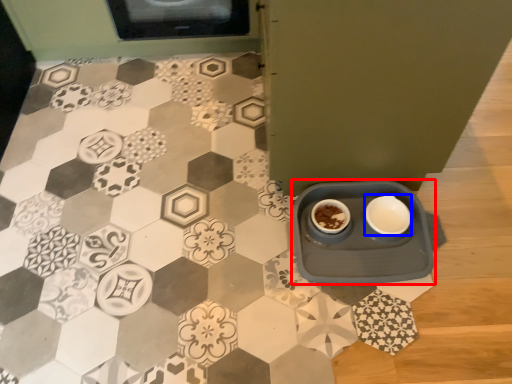
Question: Which object appears closest to the camera in this image, table (highlighted by a red box) or tableware (highlighted by a blue box)?

Choices:
 (A) table
 (B) tableware

Answer: (A)